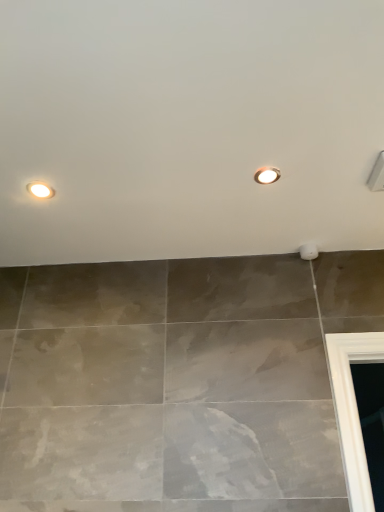
Question: In terms of height, does matte white droplight at upper center, the 1th droplight when ordered from top to bottom, look taller or shorter compared to matte white droplight at upper left, the 2th droplight positioned from the right?

Choices:
 (A) short
 (B) tall

Answer: (A)

Question: From a real-world perspective, is matte white droplight at upper center, acting as the 1th droplight starting from the right, above or below matte white droplight at upper left, which is the first droplight in bottom-to-top order?

Choices:
 (A) above
 (B) below

Answer: (A)

Question: Is point (261, 173) closer or farther from the camera than point (51, 193)?

Choices:
 (A) closer
 (B) farther

Answer: (A)

Question: From the image's perspective, relative to matte white droplight at upper center, the 1th droplight when ordered from top to bottom, is matte white droplight at upper left, the 1th droplight in the left-to-right sequence, above or below?

Choices:
 (A) below
 (B) above

Answer: (A)

Question: Considering the positions of point (38, 194) and point (276, 176), is point (38, 194) closer or farther from the camera than point (276, 176)?

Choices:
 (A) farther
 (B) closer

Answer: (A)

Question: Would you say matte white droplight at upper left, the 1th droplight in the left-to-right sequence, is inside or outside matte white droplight at upper center, acting as the 1th droplight starting from the right?

Choices:
 (A) outside
 (B) inside

Answer: (A)

Question: Is matte white droplight at upper left, the second droplight in the top-to-bottom sequence, bigger or smaller than matte white droplight at upper center, acting as the 1th droplight starting from the right?

Choices:
 (A) small
 (B) big

Answer: (B)